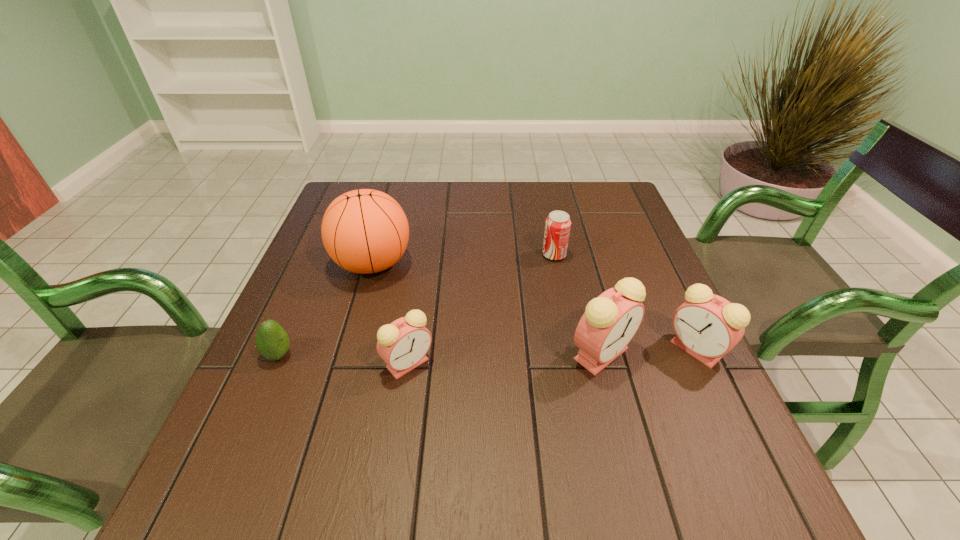
The height and width of the screenshot is (540, 960). I want to click on vacant region located on the face of the rightmost alarm clock, so click(x=639, y=349).

Identify the location of free space located 0.330m on the face of the rightmost alarm clock. Image resolution: width=960 pixels, height=540 pixels. click(510, 349).

What are the coordinates of `vacant space located 0.100m on the face of the rightmost alarm clock` in the screenshot? It's located at pos(620,349).

Identify the location of vacant point located on the back of the basketball. The height and width of the screenshot is (540, 960). (389, 206).

Where is `free space located 0.240m on the logo side of the soda can`? This screenshot has height=540, width=960. free space located 0.240m on the logo side of the soda can is located at coordinates (450, 255).

Where is `free space located on the logo side of the soda can`? The width and height of the screenshot is (960, 540). free space located on the logo side of the soda can is located at coordinates (485, 255).

I want to click on free space located on the logo side of the soda can, so click(496, 255).

The image size is (960, 540). I want to click on free space located on the back of the leftmost object, so click(x=326, y=244).

The width and height of the screenshot is (960, 540). Find the location of `basketball positioned at the left edge`. basketball positioned at the left edge is located at coordinates (364, 231).

Image resolution: width=960 pixels, height=540 pixels. I want to click on avocado that is at the left edge, so click(x=272, y=342).